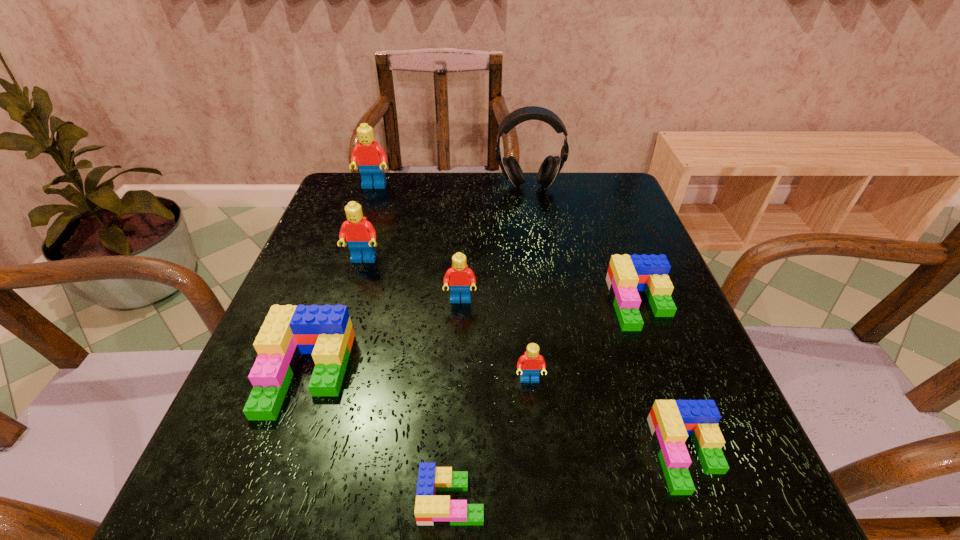
Image resolution: width=960 pixels, height=540 pixels. Find the location of `free space located 0.090m on the face of the third biggest red Lego`. free space located 0.090m on the face of the third biggest red Lego is located at coordinates (459, 342).

The height and width of the screenshot is (540, 960). Find the location of `vacant point located 0.120m on the face of the rightmost red Lego`. vacant point located 0.120m on the face of the rightmost red Lego is located at coordinates (537, 455).

The width and height of the screenshot is (960, 540). What are the coordinates of `free space located 0.140m on the right of the biggest green Lego` in the screenshot? It's located at (423, 374).

At what (x,y) coordinates should I click in order to perform the action: click on vacant space positioned 0.330m on the left of the farthest green Lego. Please return your answer as a coordinate pair (x, y). Looking at the image, I should click on (453, 303).

Image resolution: width=960 pixels, height=540 pixels. What are the coordinates of `free space located on the back of the seventh tallest Lego` in the screenshot? It's located at (665, 392).

At what (x,y) coordinates should I click in order to perform the action: click on blank space located on the back of the second green Lego from left to right. Please return your answer as a coordinate pair (x, y). The image size is (960, 540). Looking at the image, I should click on (454, 443).

At what (x,y) coordinates should I click in order to perform the action: click on earphone located at the far edge. Please return your answer as a coordinate pair (x, y). The width and height of the screenshot is (960, 540). Looking at the image, I should click on (551, 166).

Identify the location of Lego that is positioned at the far edge. (370, 157).

Image resolution: width=960 pixels, height=540 pixels. In order to click on object that is at the far left corner in this screenshot , I will do `click(370, 157)`.

Locate an element on the screen. object positioned at the near right corner is located at coordinates (671, 422).